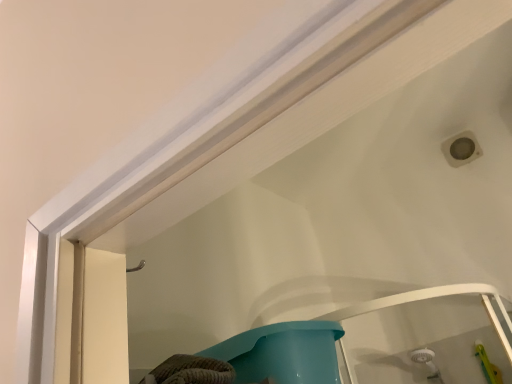
This screenshot has width=512, height=384. What do you see at coordinates (282, 353) in the screenshot?
I see `teal glossy bath at lower center` at bounding box center [282, 353].

You are a GUI agent. You are given a task and a screenshot of the screen. Output one action in this format:
    pyautogui.click(x=<x>, y=<y>)
    Task: Click on the teal glossy bath at lower center
    This screenshot has height=384, width=512.
    Given the screenshot: What is the action you would take?
    pyautogui.click(x=282, y=353)

Image resolution: width=512 pixels, height=384 pixels. What are the coordinates of `teal glossy bath at lower center` in the screenshot? It's located at (282, 353).